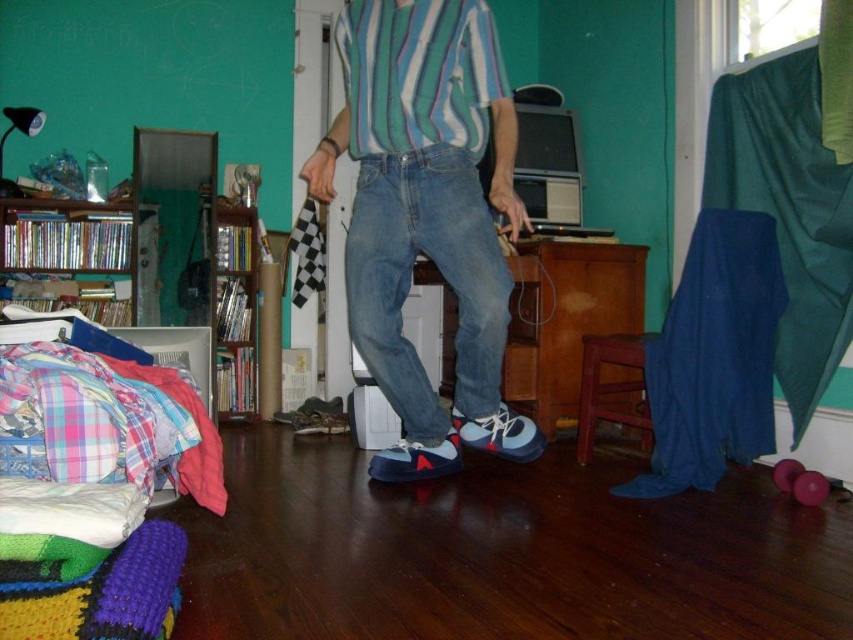
Which of these two, matte blue sneakers at center or wooden bookshelf at left, stands taller?

With more height is matte blue sneakers at center.

Who is positioned more to the left, matte blue sneakers at center or wooden bookshelf at left?

From the viewer's perspective, wooden bookshelf at left appears more on the left side.

Between point (363, 48) and point (236, 323), which one is positioned in front?

Point (363, 48) is more forward.

Where is `matte blue sneakers at center`? This screenshot has width=853, height=640. matte blue sneakers at center is located at coordinates (426, 216).